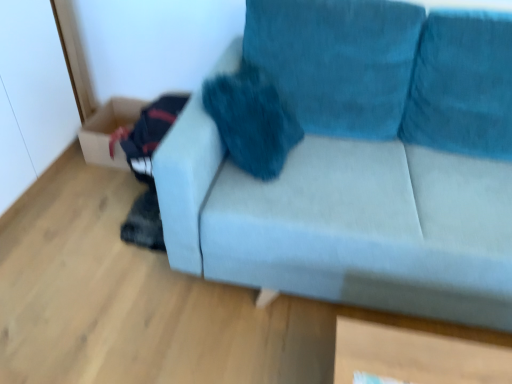
Question: From their relative heights in the image, would you say cardboard box at lower left is taller or shorter than velvet teal couch at center?

Choices:
 (A) short
 (B) tall

Answer: (A)

Question: From a real-world perspective, relative to velvet teal couch at center, is cardboard box at lower left vertically above or below?

Choices:
 (A) below
 (B) above

Answer: (A)

Question: Is cardboard box at lower left wider or thinner than velvet teal couch at center?

Choices:
 (A) thin
 (B) wide

Answer: (A)

Question: Visually, is velvet teal couch at center positioned to the left or to the right of cardboard box at lower left?

Choices:
 (A) right
 (B) left

Answer: (A)

Question: Is velvet teal couch at center bigger or smaller than cardboard box at lower left?

Choices:
 (A) big
 (B) small

Answer: (A)

Question: Is velvet teal couch at center in front of or behind cardboard box at lower left in the image?

Choices:
 (A) behind
 (B) front

Answer: (B)

Question: Considering the positions of velvet teal couch at center and cardboard box at lower left in the image, is velvet teal couch at center wider or thinner than cardboard box at lower left?

Choices:
 (A) thin
 (B) wide

Answer: (B)